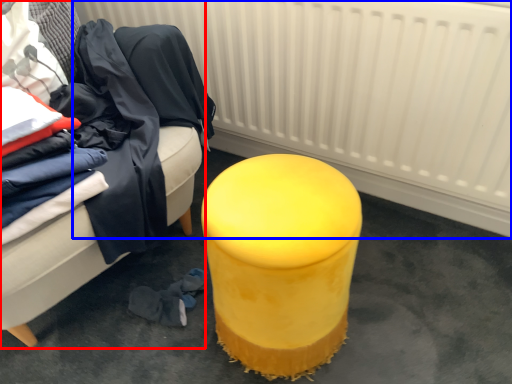
Question: Which object appears farthest to the camera in this image, furniture (highlighted by a red box) or radiator (highlighted by a blue box)?

Choices:
 (A) furniture
 (B) radiator

Answer: (B)